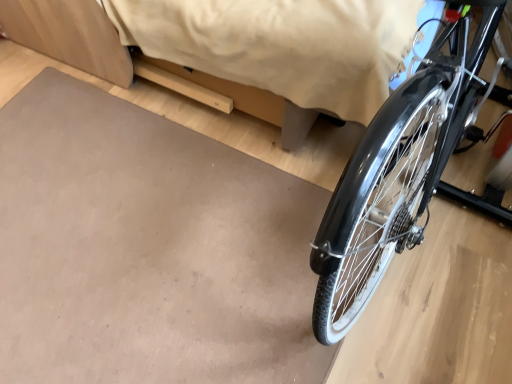
Question: From the image's perspective, is matte gray mat at lower right located above or below matte beige bed at upper center?

Choices:
 (A) above
 (B) below

Answer: (B)

Question: Is matte gray mat at lower right in front of or behind matte beige bed at upper center in the image?

Choices:
 (A) behind
 (B) front

Answer: (A)

Question: Is matte gray mat at lower right bigger or smaller than matte beige bed at upper center?

Choices:
 (A) big
 (B) small

Answer: (B)

Question: In terms of width, does matte beige bed at upper center look wider or thinner when compared to matte gray mat at lower right?

Choices:
 (A) thin
 (B) wide

Answer: (B)

Question: Which is correct: matte beige bed at upper center is inside matte gray mat at lower right, or outside of it?

Choices:
 (A) outside
 (B) inside

Answer: (A)

Question: Considering the positions of matte beige bed at upper center and matte gray mat at lower right in the image, is matte beige bed at upper center taller or shorter than matte gray mat at lower right?

Choices:
 (A) short
 (B) tall

Answer: (B)

Question: From the image's perspective, is matte beige bed at upper center above or below matte gray mat at lower right?

Choices:
 (A) below
 (B) above

Answer: (B)